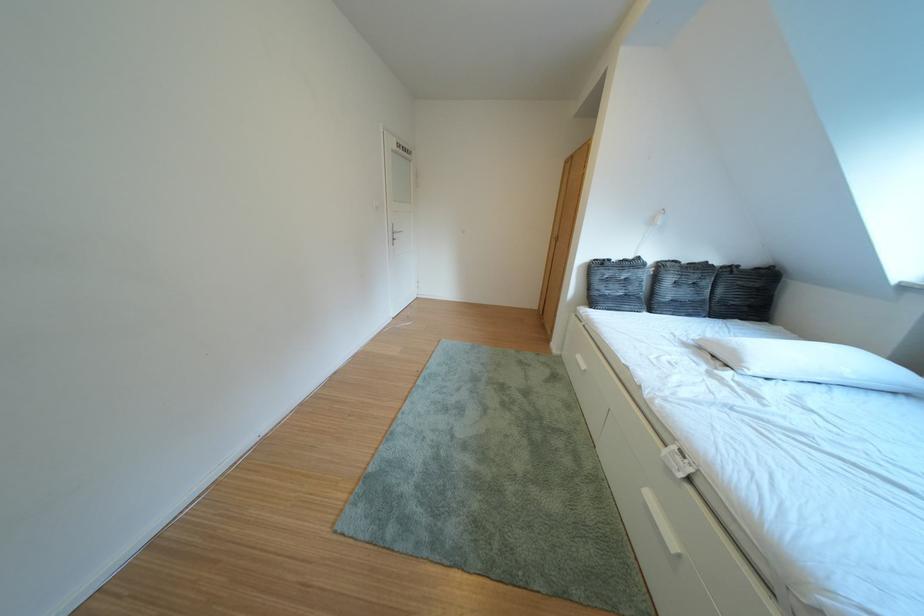
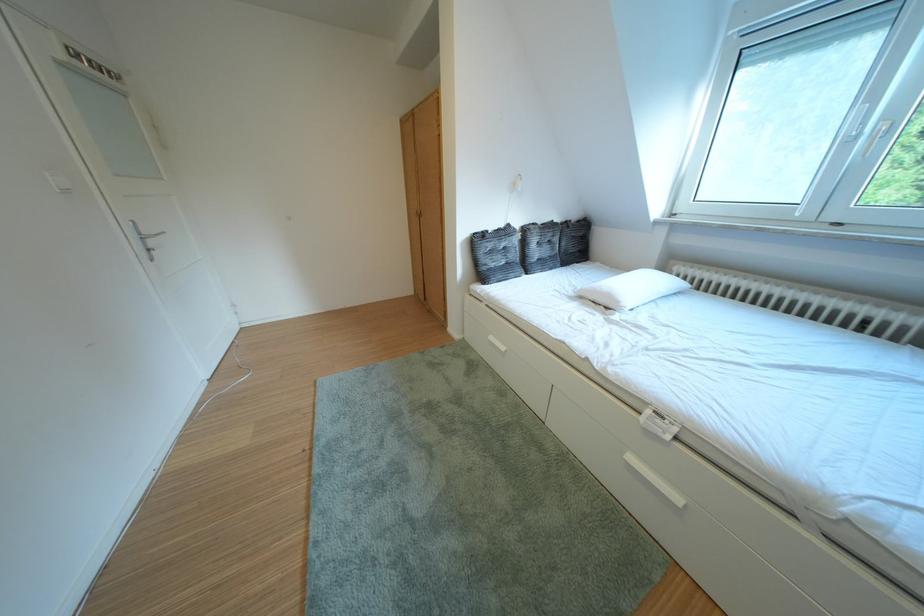
Question: The camera is either moving clockwise (left) or counter-clockwise (right) around the object. The first image is from the beginning of the video and the second image is from the end. Is the camera moving left or right when shooting the video?

Choices:
 (A) Left
 (B) Right

Answer: (A)